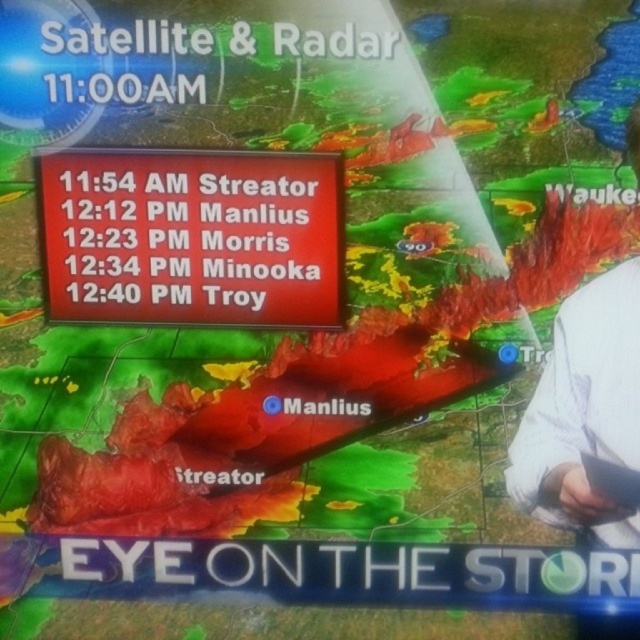
You are a weather reporter standing in front of the red matte sign at center. Your camera is positioned to your right. Can you safely walk towards the camera without bumping into it?

The red matte sign at center and camera are 1.40 meters apart, so yes, you can safely walk towards the camera without bumping into it since the distance is sufficient.

You are a weather reporter standing in front of the radar display and need to check the time listed for Minooka on the red matte sign at center. However, you notice a white fabric shirt at right in your view. Which object is closer to you, the reporter?

The red matte sign at center is closer to you than the white fabric shirt at right.

You are a weather presenter standing in front of a radar screen. You need to check the time listed on the red matte sign at center while also glancing at the white fabric shirt at right. Which object is positioned to your left?

The red matte sign at center is to the left of the white fabric shirt at right, so when facing the radar screen, the red matte sign at center would be on your left side.